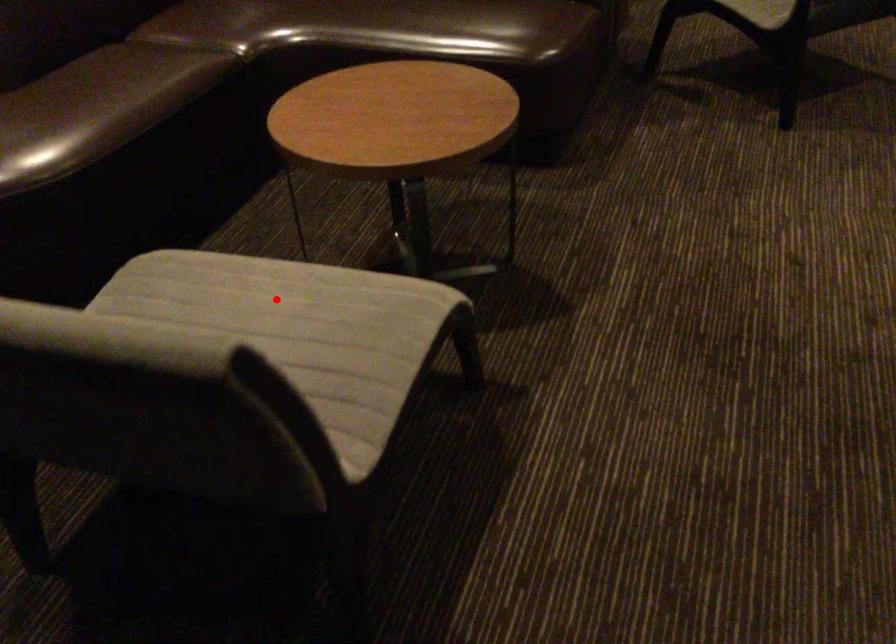
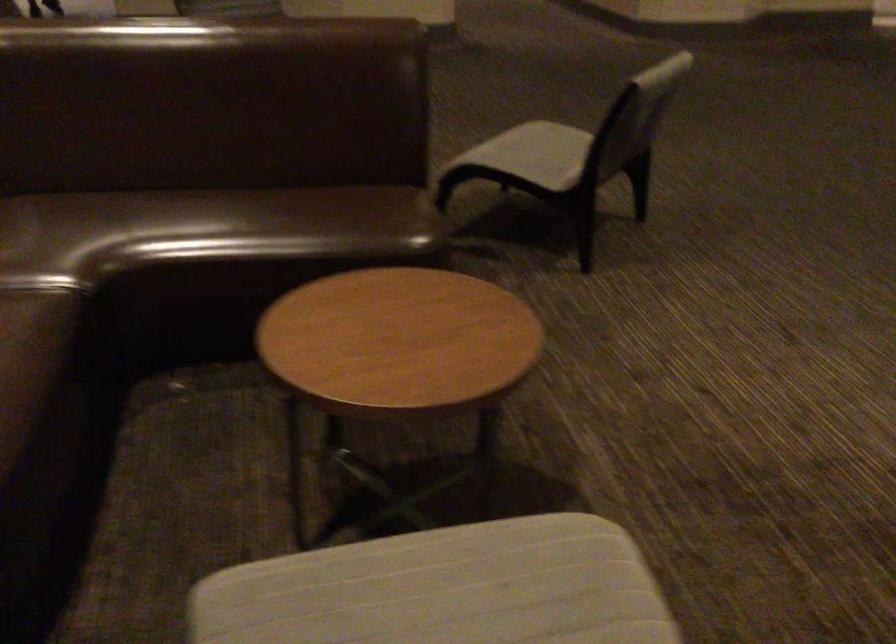
Where in the second image is the point corresponding to the highlighted location from the first image?

(444, 589)